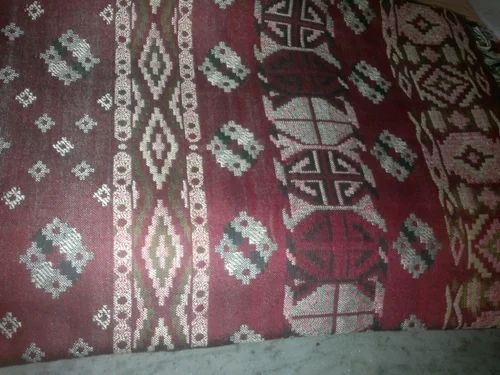
In order to click on possibly a wall in this screenshot , I will do `click(489, 17)`.